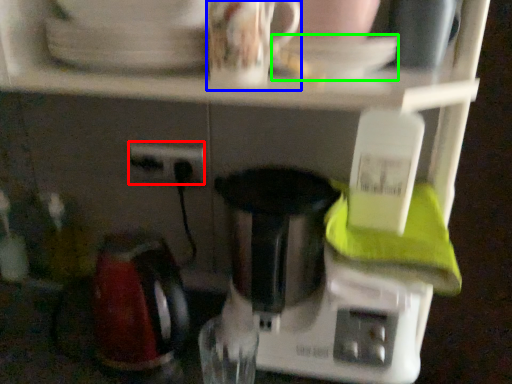
Question: Based on their relative distances, which object is farther from power plugs and sockets (highlighted by a red box)? Choose from coffee cup (highlighted by a blue box) and saucer (highlighted by a green box).

Choices:
 (A) coffee cup
 (B) saucer

Answer: (B)